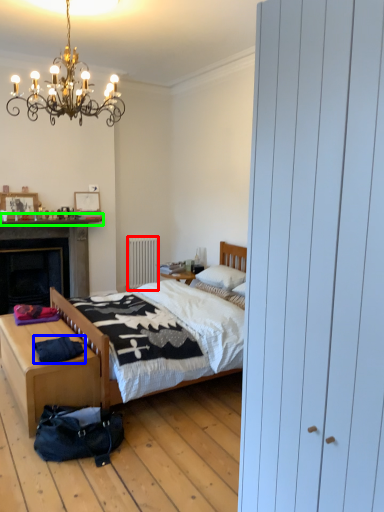
Question: Which object is positioned closest to radiator (highlighted by a red box)? Select from clothing (highlighted by a blue box) and mantle (highlighted by a green box).

Choices:
 (A) clothing
 (B) mantle

Answer: (B)